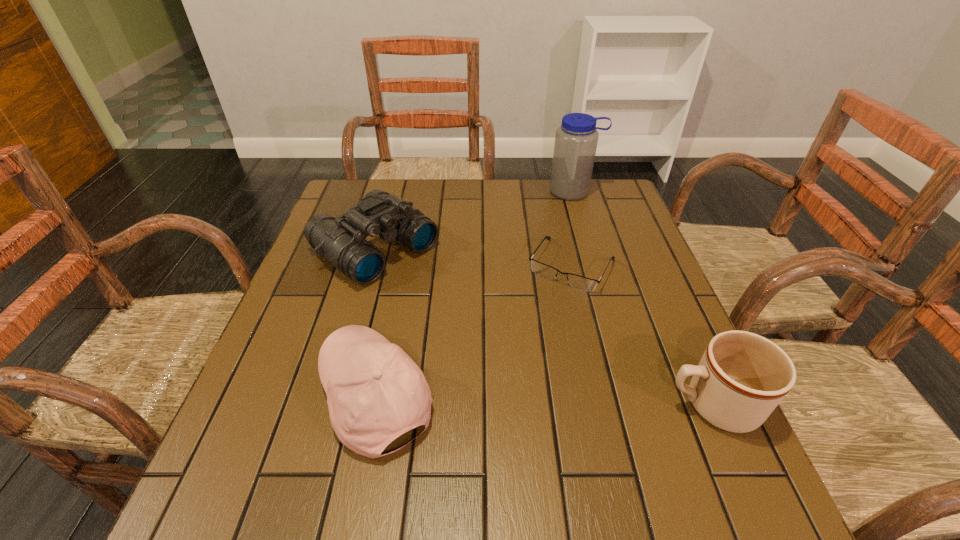
Where is `free space on the desktop that is between the baseball cap and the mug and is positioned through the lenses of the binoculars`? The image size is (960, 540). free space on the desktop that is between the baseball cap and the mug and is positioned through the lenses of the binoculars is located at coordinates (582, 401).

Locate an element on the screen. This screenshot has width=960, height=540. free spot on the desktop that is between the baseball cap and the mug and is positioned with a carrying loop on the side of the water bottle is located at coordinates (573, 401).

Where is `free space on the desktop that is between the baseball cap and the mug and is positioned on the front-facing side of the shortest object`? Image resolution: width=960 pixels, height=540 pixels. free space on the desktop that is between the baseball cap and the mug and is positioned on the front-facing side of the shortest object is located at coordinates (492, 399).